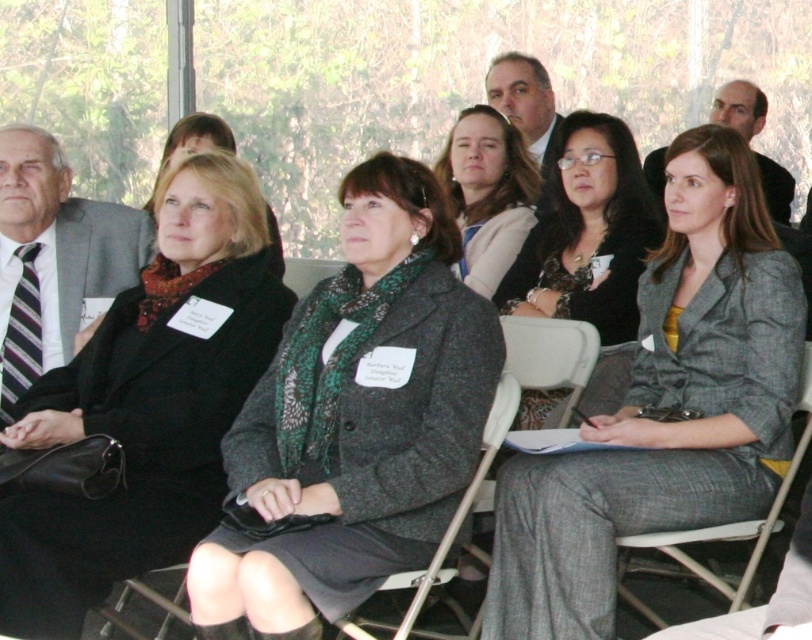
You are organizing a charity event and need to decide which item to place in a narrow display case. The case can only accommodate items with a width of 20 cm or less. You have the matte gray suit at center and the matte black scarf at center. Based on their dimensions, which item would fit better in the display case?

The matte gray suit at center is thinner than the matte black scarf at center, so the matte gray suit at center would fit better in the narrow display case since it has a smaller width.

You are a photographer trying to capture a candid shot of the gray wool blazer at center and the gray fabric chair at center. From the perspective of the photographer, which object is positioned to the left?

The gray fabric chair at center is positioned to the left of the gray wool blazer at center, so the gray fabric chair at center would be the one to the left.

You are attending a professional event and notice two items worn by the central attendee in the image. The items are the matte gray suit at center and the matte black scarf at center. Which item is positioned higher on her body?

The matte gray suit at center is positioned higher on her body than the matte black scarf at center.